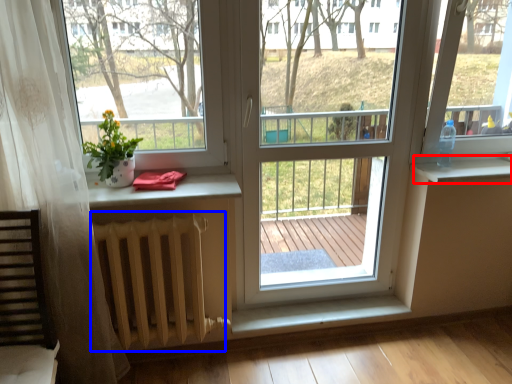
Question: Which of the following is the farthest to the observer, window sill (highlighted by a red box) or radiator (highlighted by a blue box)?

Choices:
 (A) window sill
 (B) radiator

Answer: (A)